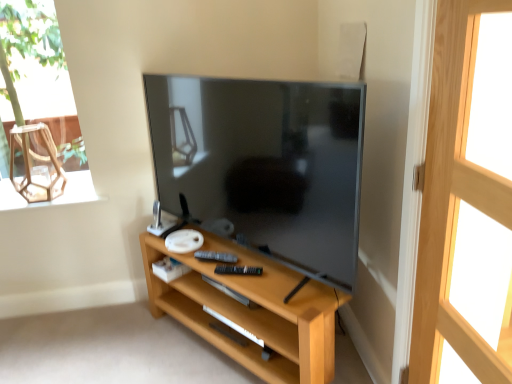
At what (x,y) coordinates should I click in order to perform the action: click on free space behind black plastic remote at center. Please return your answer as a coordinate pair (x, y). Looking at the image, I should click on (214, 249).